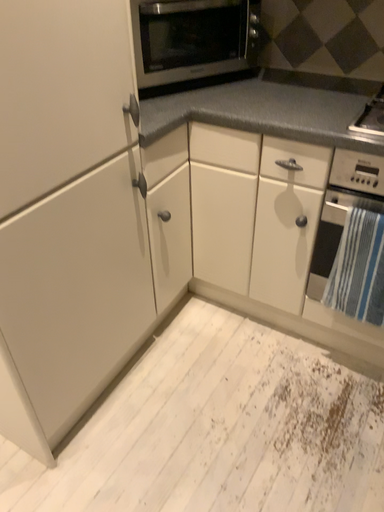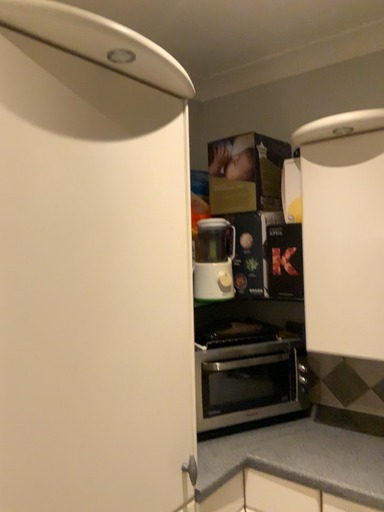
Question: How did the camera likely rotate when shooting the video?

Choices:
 (A) rotated upward
 (B) rotated downward

Answer: (A)